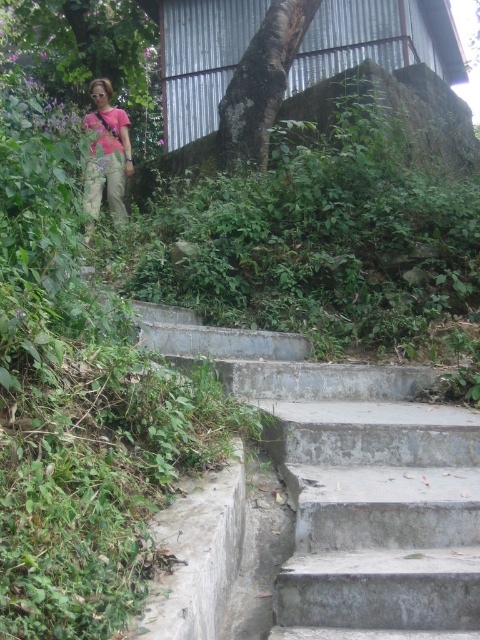
You are standing at the base of the gray concrete stairs at center. If you walk straight ahead, will you eventually reach the structure in the background?

Yes, because the gray concrete stairs at center lead up to the structure in the background.

You are a gardener standing at the bottom of the gray concrete stairs at center. You need to trim the dark brown bark tree at center. Which direction should you move to reach the tree?

The gray concrete stairs at center is located below the dark brown bark tree at center, so you should move upward along the gray concrete stairs at center to reach the dark brown bark tree at center.